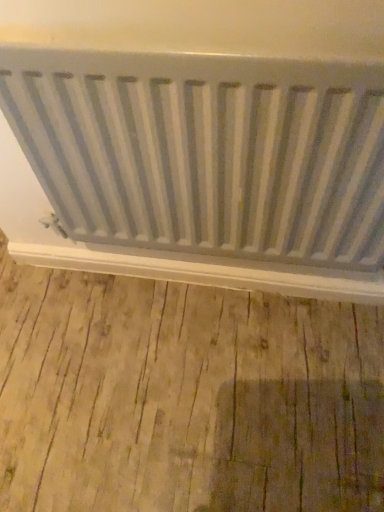
I want to click on vacant region below white matte radiator at center (from a real-world perspective), so coord(206,298).